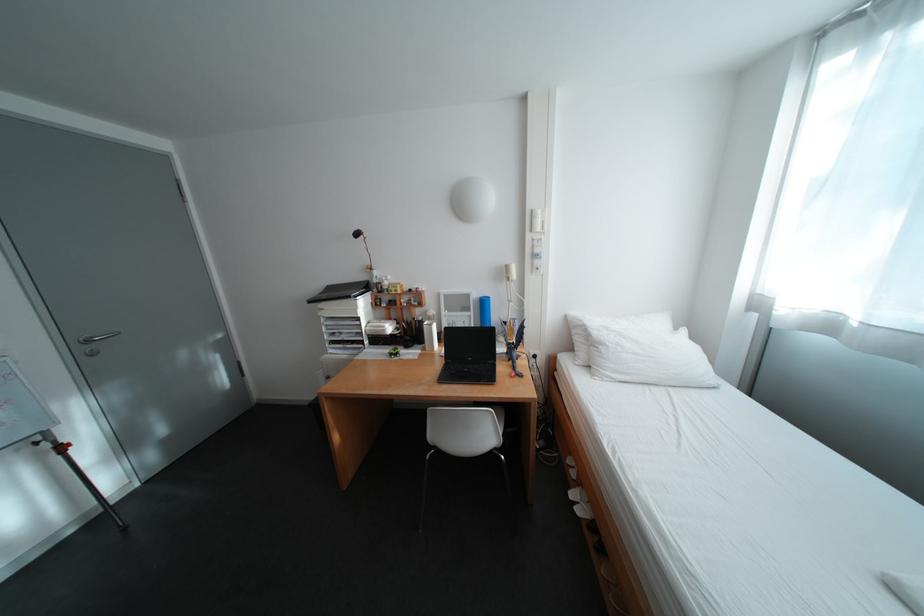
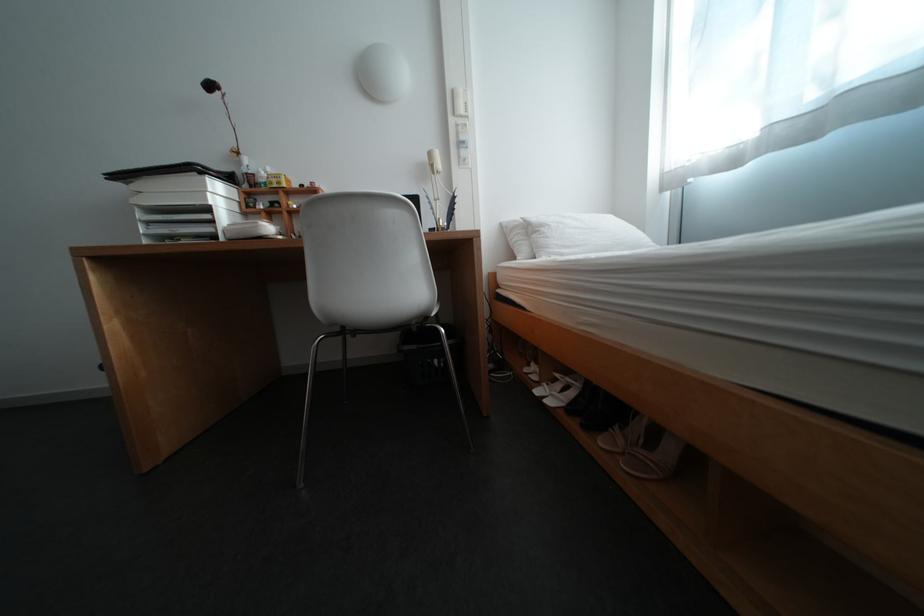
The point at (396, 328) is marked in the first image. Where is the corresponding point in the second image?

(270, 224)